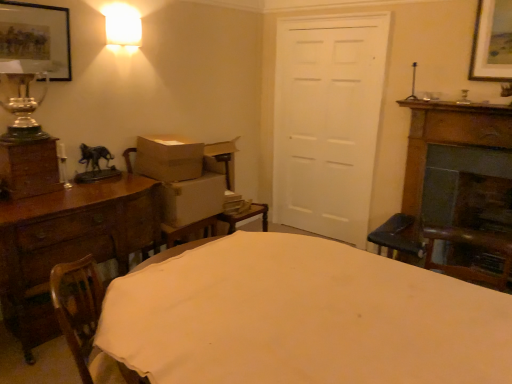
Question: Considering the positions of matte black picture frame at upper left and brown cardboard box at center, marked as the 2th cardboard box in a bottom-to-top arrangement, in the image, is matte black picture frame at upper left wider or thinner than brown cardboard box at center, marked as the 2th cardboard box in a bottom-to-top arrangement,?

Choices:
 (A) wide
 (B) thin

Answer: (B)

Question: Based on their sizes in the image, would you say matte black picture frame at upper left is bigger or smaller than brown cardboard box at center, the first cardboard box when ordered from top to bottom?

Choices:
 (A) small
 (B) big

Answer: (A)

Question: Considering the real-world distances, which object is closest to the white cloth-covered table at center?

Choices:
 (A) white cardboard box at left, which appears as the 2th cardboard box when viewed from the top
 (B) shiny glass vase at left
 (C) white matte door at center
 (D) wooden swivel chair at lower left
 (E) matte black picture frame at upper left

Answer: (D)

Question: Considering the real-world distances, which object is farthest from the white cloth-covered table at center?

Choices:
 (A) wooden chest of drawers at left
 (B) white cardboard box at left, which is the first cardboard box from bottom to top
 (C) wooden swivel chair at lower left
 (D) white matte door at center
 (E) shiny glass vase at left

Answer: (D)